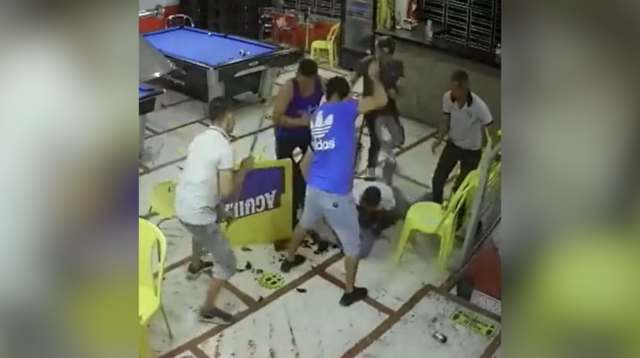
This screenshot has width=640, height=358. What are the coordinates of `billiards table pockets` in the screenshot? It's located at (180, 27), (224, 37), (282, 48), (212, 66), (160, 51).